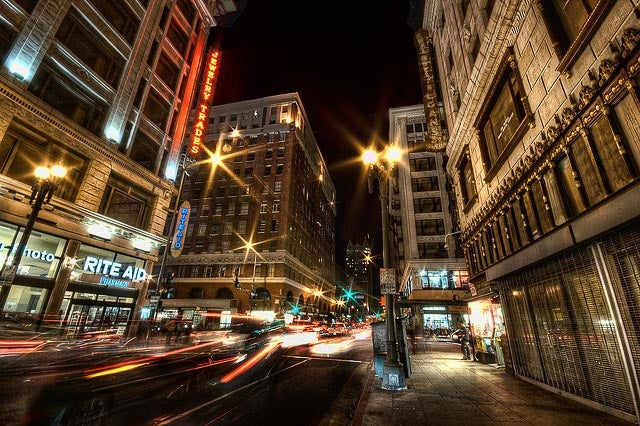
Locate an element on the screen. This screenshot has height=426, width=640. poster is located at coordinates (386, 284), (3, 277).